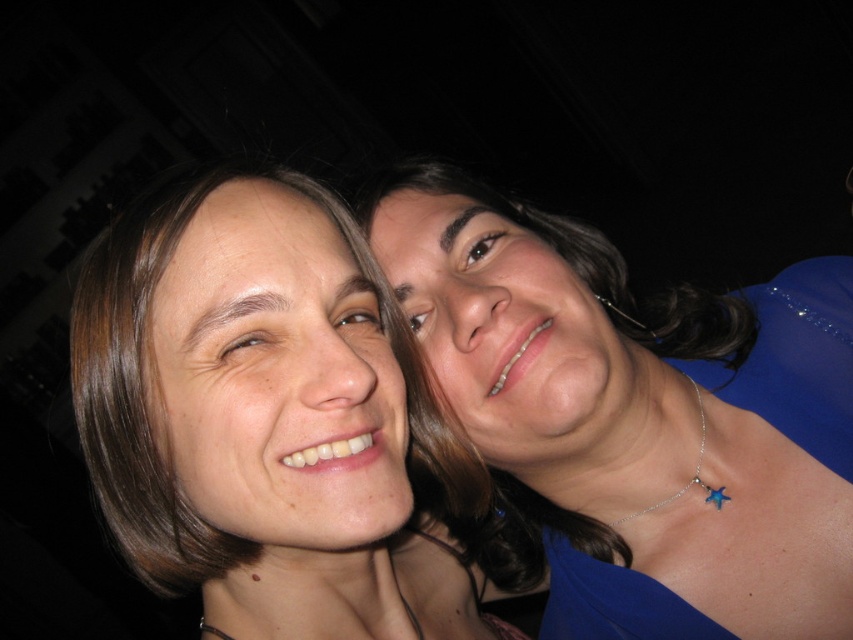
You are a photographer trying to adjust the lighting for a photo shoot. You notice there is a point at coordinates (639, 416) in the image. What object is located at this point?

The point at coordinates (639, 416) marks the blue satin dress at right.

You are a photographer adjusting the lighting for a portrait. You need to ensure that both the blue satin dress at right and the smooth skin face at center are properly illuminated. Given their relative sizes, which object requires a wider light source to capture its full width?

The blue satin dress at right requires a wider light source because its width surpasses that of the smooth skin face at center.

You are a photographer standing 2 feet away from the blue satin dress at right. Can you reach it without moving your feet?

The blue satin dress at right is 21.35 inches from viewer, so yes, the photographer can reach it without moving their feet since 21.35 inches is less than 2 feet.